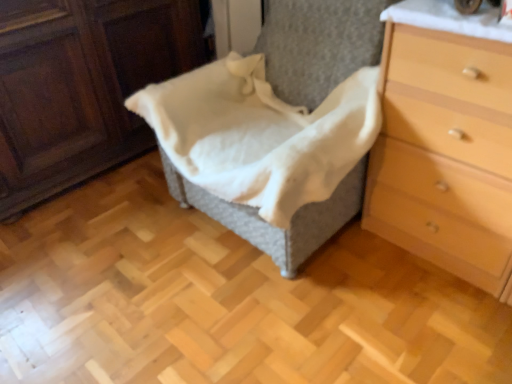
Question: Is point (234, 152) positioned closer to the camera than point (121, 94)?

Choices:
 (A) farther
 (B) closer

Answer: (B)

Question: From the image's perspective, relative to woven fabric basket at center, is white cotton blanket at center above or below?

Choices:
 (A) below
 (B) above

Answer: (A)

Question: Based on their relative distances, which object is nearer to the woven fabric basket at center?

Choices:
 (A) white cotton blanket at center
 (B) light brown wood chest of drawers at right

Answer: (A)

Question: Estimate the real-world distances between objects in this image. Which object is closer to the woven fabric basket at center?

Choices:
 (A) white cotton blanket at center
 (B) light brown wood chest of drawers at right

Answer: (A)